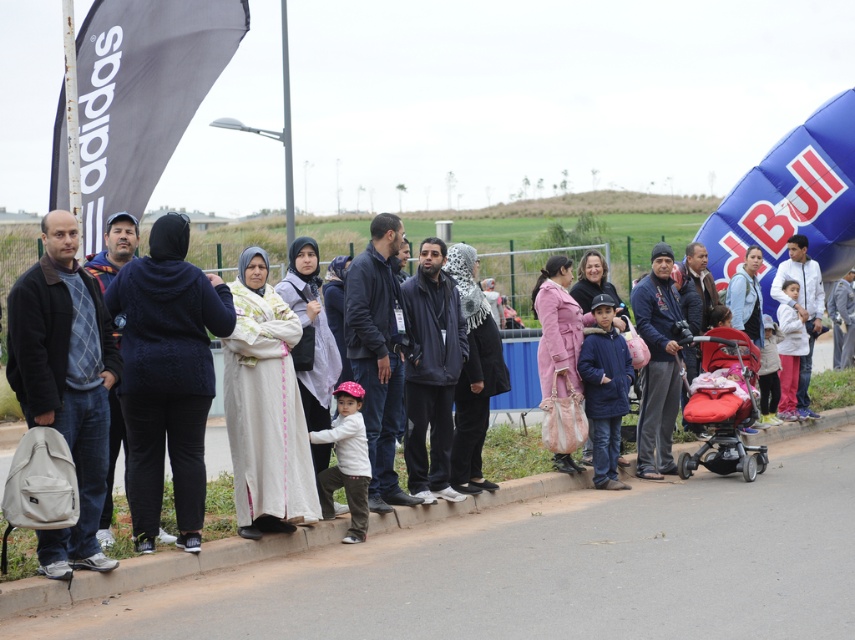
Question: Observing the image, what is the correct spatial positioning of brown concrete curb at lower center in reference to dark blue fleece at center?

Choices:
 (A) below
 (B) above

Answer: (A)

Question: Is the position of matte black jacket at left less distant than that of matte white shirt at center?

Choices:
 (A) no
 (B) yes

Answer: (B)

Question: Based on their relative distances, which object is nearer to the matte red baby carriage at right?

Choices:
 (A) dark blue hoodie at center
 (B) matte white shirt at center
 (C) dark blue fleece at center

Answer: (A)

Question: Among these points, which one is nearest to the camera?

Choices:
 (A) (105, 566)
 (B) (659, 568)
 (C) (711, 360)
 (D) (358, 417)

Answer: (A)

Question: Does matte black jacket at left appear under matte white shirt at center?

Choices:
 (A) no
 (B) yes

Answer: (A)

Question: Which point is closer to the camera?

Choices:
 (A) dark blue fleece at center
 (B) dark blue hoodie at center
 (C) matte white shirt at center
 (D) matte red baby carriage at right

Answer: (B)